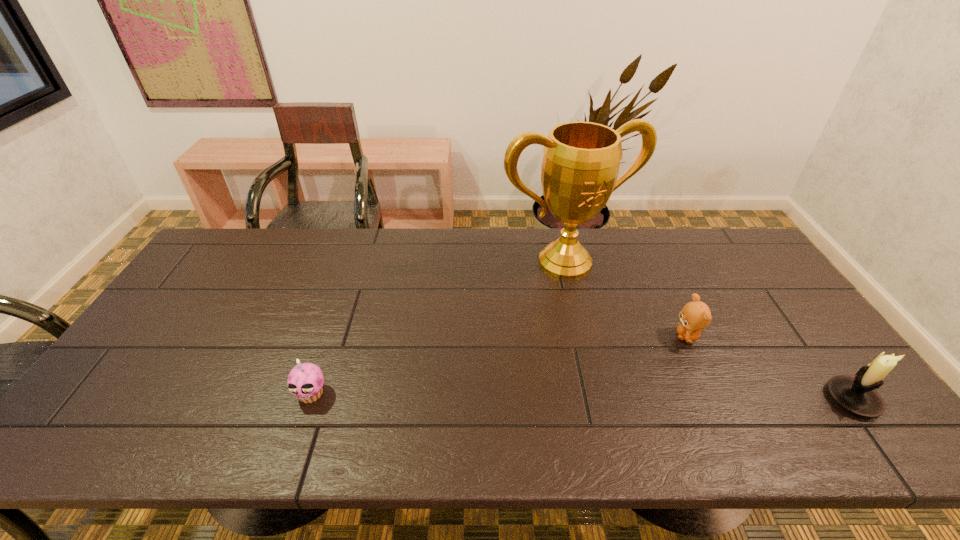
You are a GUI agent. You are given a task and a screenshot of the screen. Output one action in this format:
    pyautogui.click(x=<x>, y=<y>)
    Task: Click on the blank area in the image that satisfies the following two spatial constraints: 1. on the face of the rightmost object; 2. on the left side of the cupcake
    
    Given the screenshot: What is the action you would take?
    pyautogui.click(x=309, y=399)

Where is `vacant area that satisfies the following two spatial constraints: 1. on the front side of the second tallest object; 2. on the right side of the tallest object`? The width and height of the screenshot is (960, 540). vacant area that satisfies the following two spatial constraints: 1. on the front side of the second tallest object; 2. on the right side of the tallest object is located at coordinates (597, 399).

This screenshot has width=960, height=540. Identify the location of free space that satisfies the following two spatial constraints: 1. on the face of the leftmost object; 2. on the left side of the candle holder. (309, 399).